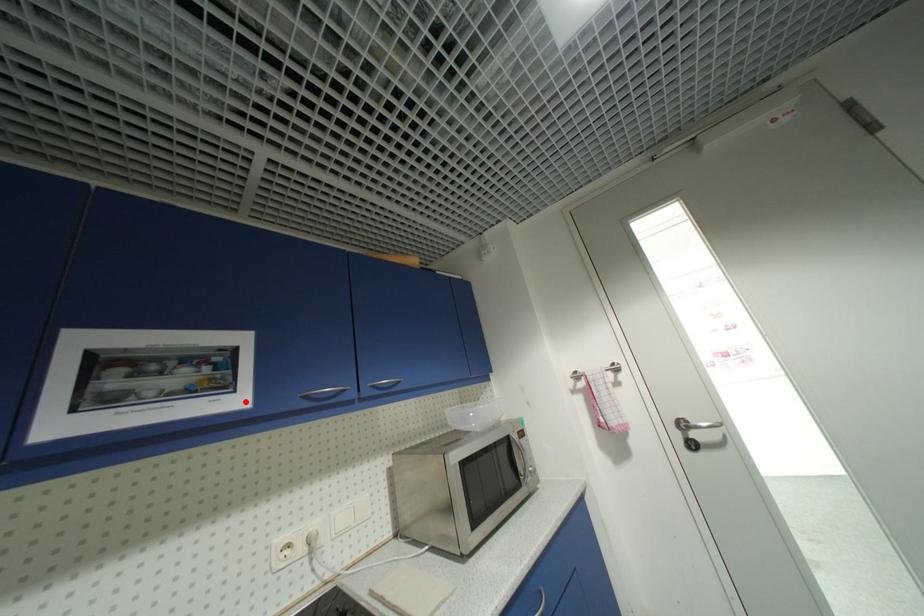
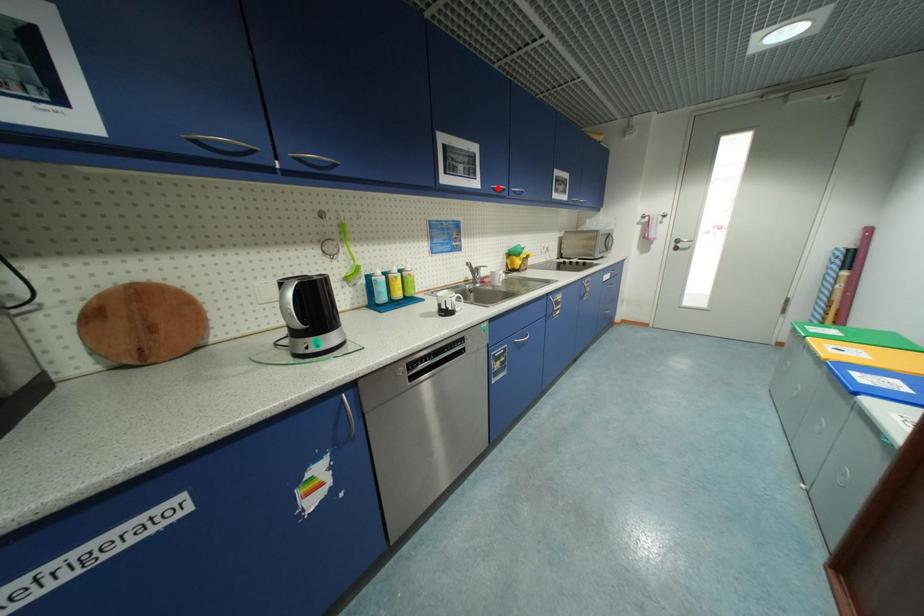
I am providing you with two images of the same scene from different viewpoints. A red point is marked on the first image and another point is marked on the second image. Is the marked point in image1 the same physical position as the marked point in image2?

No